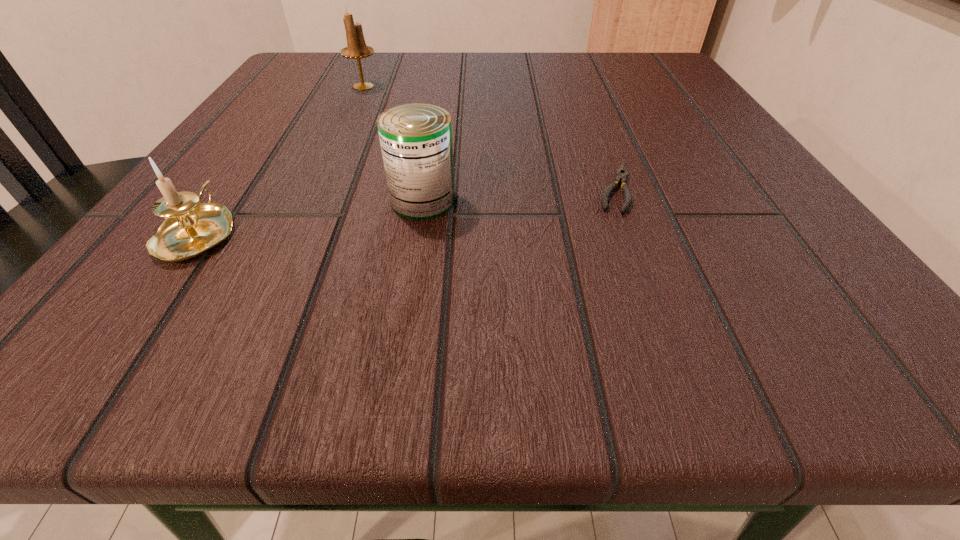
The height and width of the screenshot is (540, 960). Identify the location of vacant point located between the shortest object and the second object from right to left. (519, 194).

Image resolution: width=960 pixels, height=540 pixels. Find the location of `object that is the closest one to the third object from right to left`. object that is the closest one to the third object from right to left is located at coordinates (416, 139).

I want to click on the closest object to the farther candle holder, so coord(416,139).

Identify the location of free space that satisfies the following two spatial constraints: 1. on the handle side of the pliers; 2. on the left side of the shorter candle holder. Image resolution: width=960 pixels, height=540 pixels. (229, 188).

You are a GUI agent. You are given a task and a screenshot of the screen. Output one action in this format:
    pyautogui.click(x=<x>, y=<y>)
    Task: Click on the free space that satisfies the following two spatial constraints: 1. on the handle side of the leftmost object; 2. on the left side of the tallest object
    
    Given the screenshot: What is the action you would take?
    pyautogui.click(x=301, y=86)

Locate an element on the screen. This screenshot has height=540, width=960. vacant space that satisfies the following two spatial constraints: 1. on the handle side of the farthest object; 2. on the right side of the shorter candle holder is located at coordinates (301, 86).

The width and height of the screenshot is (960, 540). In order to click on free space that satisfies the following two spatial constraints: 1. on the handle side of the left candle holder; 2. on the right side of the taller candle holder in this screenshot , I will do (x=301, y=86).

Locate an element on the screen. This screenshot has height=540, width=960. free space that satisfies the following two spatial constraints: 1. on the handle side of the shortest object; 2. on the right side of the left candle holder is located at coordinates (229, 188).

This screenshot has height=540, width=960. I want to click on free region that satisfies the following two spatial constraints: 1. on the handle side of the third object from left to right; 2. on the right side of the nearer candle holder, so click(221, 201).